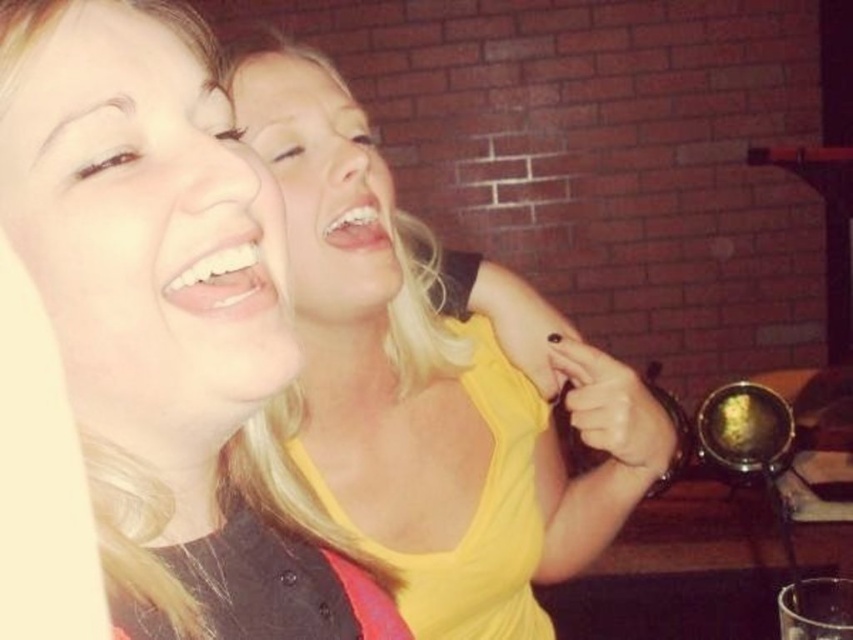
Question: Which object appears closest to the camera in this image?

Choices:
 (A) yellow matte tank top at center
 (B) yellow matte tank top at upper center

Answer: (B)

Question: Is yellow matte tank top at upper center to the left of yellow matte tank top at center from the viewer's perspective?

Choices:
 (A) yes
 (B) no

Answer: (A)

Question: Is yellow matte tank top at upper center positioned in front of yellow matte tank top at center?

Choices:
 (A) no
 (B) yes

Answer: (B)

Question: Does yellow matte tank top at upper center have a greater width compared to yellow matte tank top at center?

Choices:
 (A) no
 (B) yes

Answer: (A)

Question: Which of the following is the farthest from the observer?

Choices:
 (A) (148, 120)
 (B) (503, 269)

Answer: (B)

Question: Which point is closer to the camera?

Choices:
 (A) (252, 330)
 (B) (549, 499)

Answer: (A)